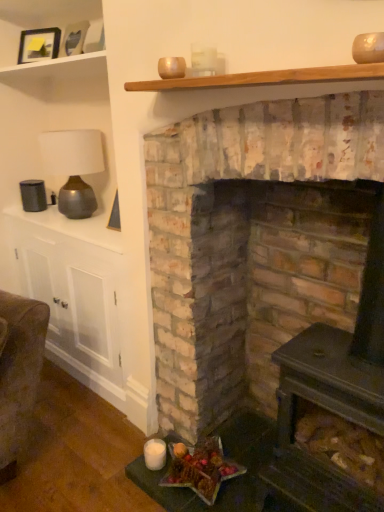
Find the location of a particular element. wooden shelf at upper left, which ranks as the 2th shelf in right-to-left order is located at coordinates (39, 20).

Measure the distance between matte brown lamp at upper left and camera.

2.01 meters.

Describe the element at coordinates (39, 45) in the screenshot. This screenshot has height=512, width=384. I see `matte black picture frame at upper left, placed as the 2th picture frame when sorted from right to left` at that location.

I want to click on wooden plank at upper center, positioned as the 1th shelf in bottom-to-top order, so click(x=263, y=78).

From the image's perspective, would you say shiny metallic star at lower center is positioned over brick fireplace at center?

No.

In terms of height, does shiny metallic star at lower center look taller or shorter compared to brick fireplace at center?

shiny metallic star at lower center is shorter than brick fireplace at center.

From a real-world perspective, which is physically above, shiny metallic star at lower center or brick fireplace at center?

brick fireplace at center is physically above.

Is shiny metallic star at lower center far from brick fireplace at center?

No.

From the image's perspective, which object appears higher, wooden plank at upper center, which is the 2th shelf from left to right, or shiny metallic star at lower center?

wooden plank at upper center, which is the 2th shelf from left to right, is shown above in the image.

Can you confirm if wooden plank at upper center, which is the 2th shelf from left to right, is shorter than shiny metallic star at lower center?

Yes, wooden plank at upper center, which is the 2th shelf from left to right, is shorter than shiny metallic star at lower center.

Is wooden plank at upper center, which appears as the 1th shelf when viewed from the front, with shiny metallic star at lower center?

No, wooden plank at upper center, which appears as the 1th shelf when viewed from the front, is not next to shiny metallic star at lower center.

How different are the orientations of matte brown lamp at upper left and wooden picture frame at upper left, acting as the first picture frame starting from the front, in degrees?

0.000598 degrees separate the facing orientations of matte brown lamp at upper left and wooden picture frame at upper left, acting as the first picture frame starting from the front.

From the image's perspective, is matte brown lamp at upper left on top of wooden picture frame at upper left, the 1th picture frame viewed from the right?

No, from the image's perspective, matte brown lamp at upper left is not on top of wooden picture frame at upper left, the 1th picture frame viewed from the right.

Which object is wider, matte brown lamp at upper left or wooden picture frame at upper left, acting as the first picture frame starting from the front?

matte brown lamp at upper left is wider.

From a real-world perspective, is matte black picture frame at upper left, placed as the 2th picture frame when sorted from right to left, physically located above or below shiny metallic star at lower center?

matte black picture frame at upper left, placed as the 2th picture frame when sorted from right to left, is above shiny metallic star at lower center.

What's the angular difference between matte black picture frame at upper left, the second picture frame when ordered from front to back, and shiny metallic star at lower center's facing directions?

They differ by 16.4 degrees in their facing directions.

How much distance is there between matte black picture frame at upper left, the 1th picture frame viewed from the back, and shiny metallic star at lower center?

matte black picture frame at upper left, the 1th picture frame viewed from the back, is 1.85 meters away from shiny metallic star at lower center.

Can we say matte black picture frame at upper left, the second picture frame when ordered from front to back, lies outside shiny metallic star at lower center?

Indeed, matte black picture frame at upper left, the second picture frame when ordered from front to back, is completely outside shiny metallic star at lower center.

Is matte brown lamp at upper left at the left side of brick fireplace at center?

Yes, matte brown lamp at upper left is to the left of brick fireplace at center.

From a real-world perspective, who is located lower, matte brown lamp at upper left or brick fireplace at center?

In real-world perspective, brick fireplace at center is lower.

Relative to brick fireplace at center, is matte brown lamp at upper left in front or behind?

Clearly, matte brown lamp at upper left is behind brick fireplace at center.

Is matte brown lamp at upper left inside the boundaries of brick fireplace at center, or outside?

matte brown lamp at upper left is outside brick fireplace at center.

From the image's perspective, between matte brown lamp at upper left and wooden plank at upper center, which appears as the 1th shelf when viewed from the front, who is located below?

matte brown lamp at upper left appears lower in the image.

Can you confirm if matte brown lamp at upper left is smaller than wooden plank at upper center, which is the 2th shelf from left to right?

Actually, matte brown lamp at upper left might be larger than wooden plank at upper center, which is the 2th shelf from left to right.

In terms of height, does matte brown lamp at upper left look taller or shorter compared to wooden plank at upper center, which is the 2th shelf from left to right?

Clearly, matte brown lamp at upper left is taller compared to wooden plank at upper center, which is the 2th shelf from left to right.

Is matte brown lamp at upper left spatially inside wooden shelf at upper left, marked as the first shelf in a left-to-right arrangement, or outside of it?

matte brown lamp at upper left is spatially situated outside wooden shelf at upper left, marked as the first shelf in a left-to-right arrangement.

Who is smaller, matte brown lamp at upper left or wooden shelf at upper left, placed as the 1th shelf when sorted from top to bottom?

Smaller between the two is matte brown lamp at upper left.

From a real-world perspective, which is physically above, matte brown lamp at upper left or wooden shelf at upper left, marked as the first shelf in a left-to-right arrangement?

wooden shelf at upper left, marked as the first shelf in a left-to-right arrangement, from a real-world perspective.

How far apart are matte brown lamp at upper left and wooden shelf at upper left, arranged as the 2th shelf when ordered from the bottom?

matte brown lamp at upper left is 23.54 inches from wooden shelf at upper left, arranged as the 2th shelf when ordered from the bottom.

The height and width of the screenshot is (512, 384). In order to click on fireplace above the shiny metallic star at lower center (from the image's perspective) in this screenshot , I will do `click(254, 244)`.

This screenshot has width=384, height=512. In the image, there is a wooden plank at upper center, which is the 2th shelf from left to right. What are the coordinates of `food below it (from the image's perspective)` in the screenshot? It's located at (201, 469).

Consider the image. From the image, which object appears to be nearer to shiny metallic star at lower center, matte black picture frame at upper left, placed as the 2th picture frame when sorted from right to left, or matte brown lamp at upper left?

Based on the image, matte brown lamp at upper left appears to be nearer to shiny metallic star at lower center.

Estimate the real-world distances between objects in this image. Which object is closer to matte black picture frame at upper left, which appears as the 1th picture frame when viewed from the left, wooden shelf at upper left, the first shelf when ordered from back to front, or wooden picture frame at upper left, the 1th picture frame viewed from the right?

Based on the image, wooden picture frame at upper left, the 1th picture frame viewed from the right, appears to be nearer to matte black picture frame at upper left, which appears as the 1th picture frame when viewed from the left.

Considering their positions, is wooden shelf at upper left, marked as the first shelf in a left-to-right arrangement, positioned closer to brick fireplace at center than matte black picture frame at upper left, the second picture frame when ordered from front to back?

Among the two, matte black picture frame at upper left, the second picture frame when ordered from front to back, is located nearer to brick fireplace at center.

Which object lies nearer to the anchor point wooden plank at upper center, the second shelf when ordered from back to front, wooden shelf at upper left, marked as the first shelf in a left-to-right arrangement, or matte brown lamp at upper left?

Among the two, matte brown lamp at upper left is located nearer to wooden plank at upper center, the second shelf when ordered from back to front.

Considering their positions, is brick fireplace at center positioned further to matte brown lamp at upper left than wooden plank at upper center, which is the second shelf in top-to-bottom order?

wooden plank at upper center, which is the second shelf in top-to-bottom order, is positioned further to the anchor matte brown lamp at upper left.

Estimate the real-world distances between objects in this image. Which object is closer to wooden shelf at upper left, placed as the 1th shelf when sorted from top to bottom, matte black picture frame at upper left, which appears as the 1th picture frame when viewed from the left, or wooden plank at upper center, positioned as the 1th shelf in bottom-to-top order?

matte black picture frame at upper left, which appears as the 1th picture frame when viewed from the left.

Based on their spatial positions, is shiny metallic star at lower center or matte brown lamp at upper left further from wooden shelf at upper left, which ranks as the 2th shelf in right-to-left order?

shiny metallic star at lower center is positioned further to the anchor wooden shelf at upper left, which ranks as the 2th shelf in right-to-left order.

Based on their spatial positions, is wooden shelf at upper left, placed as the 1th shelf when sorted from top to bottom, or matte brown lamp at upper left closer to wooden picture frame at upper left, the 2th picture frame from the back?

Based on the image, wooden shelf at upper left, placed as the 1th shelf when sorted from top to bottom, appears to be nearer to wooden picture frame at upper left, the 2th picture frame from the back.

Find the location of `picture frame between brick fireplace at center and matte black picture frame at upper left, the second picture frame when ordered from front to back, from front to back`. picture frame between brick fireplace at center and matte black picture frame at upper left, the second picture frame when ordered from front to back, from front to back is located at coordinates (73, 39).

Locate an element on the screen. lamp between matte black picture frame at upper left, placed as the 2th picture frame when sorted from right to left, and shiny metallic star at lower center from top to bottom is located at coordinates (x=73, y=167).

This screenshot has width=384, height=512. Identify the location of lamp between wooden picture frame at upper left, acting as the first picture frame starting from the front, and shiny metallic star at lower center vertically. point(73,167).

The height and width of the screenshot is (512, 384). I want to click on shelf positioned between wooden plank at upper center, positioned as the 1th shelf in bottom-to-top order, and matte brown lamp at upper left from near to far, so click(x=39, y=20).